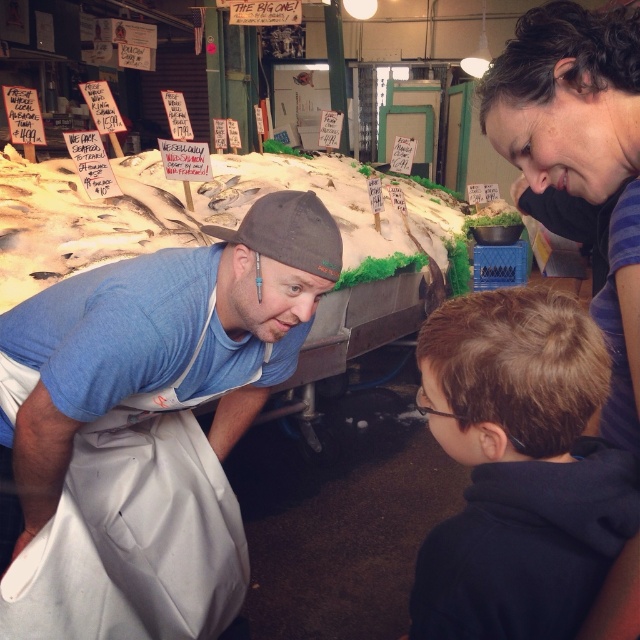
You are a customer at the fish market. You see the dark blue hoodie at lower right and the blue fabric shirt at lower left. Which one is positioned more to the right side of the image?

The dark blue hoodie at lower right is positioned more to the right than the blue fabric shirt at lower left.

You are a customer at the fish market. You see the white fish at center and the dark brown curly hair at upper right. Which one is bigger in size?

The white fish at center is larger in size than the dark brown curly hair at upper right.

You are standing at the fish market and want to locate the point at coordinates (518, 468). According to the scene, where exactly is this point located?

The point at coordinates (518, 468) is located on the dark blue hoodie at lower right.